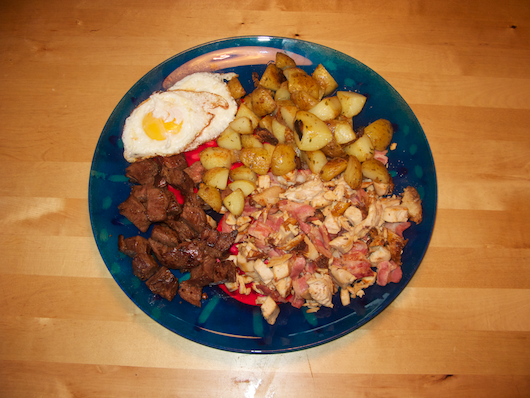
This screenshot has width=530, height=398. In order to click on wooden table in this screenshot , I will do [x=81, y=91].